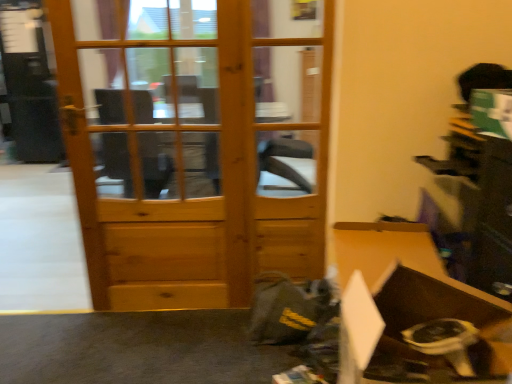
Where is `brown cardboard box at lower right`? The width and height of the screenshot is (512, 384). brown cardboard box at lower right is located at coordinates tap(422, 333).

What is the approximate height of brown cardboard box at lower right?

10.97 inches.

The image size is (512, 384). What do you see at coordinates (422, 333) in the screenshot? I see `brown cardboard box at lower right` at bounding box center [422, 333].

Identify the location of natural wood door at left. (195, 144).

What do you see at coordinates (195, 144) in the screenshot? I see `natural wood door at left` at bounding box center [195, 144].

Measure the distance between point (189, 43) and camera.

Point (189, 43) is 5.60 feet away from camera.

At what (x,y) coordinates should I click in order to perform the action: click on brown cardboard box at lower right. Please return your answer as a coordinate pair (x, y). The image size is (512, 384). Looking at the image, I should click on (422, 333).

Between natural wood door at left and brown cardboard box at lower right, which one appears on the left side from the viewer's perspective?

natural wood door at left.

Is natural wood door at left positioned in front of brown cardboard box at lower right?

No, it is not.

Is point (98, 181) closer or farther from the camera than point (395, 342)?

Point (98, 181) is farther from the camera than point (395, 342).

From the image's perspective, is natural wood door at left beneath brown cardboard box at lower right?

No.

From a real-world perspective, which object rests below the other?

In real-world perspective, brown cardboard box at lower right is lower.

Based on the photo, which of these two, natural wood door at left or brown cardboard box at lower right, is thinner?

With smaller width is natural wood door at left.

Consider the image. Considering the sizes of objects natural wood door at left and brown cardboard box at lower right in the image provided, who is taller, natural wood door at left or brown cardboard box at lower right?

With more height is natural wood door at left.

Which of these two, natural wood door at left or brown cardboard box at lower right, is bigger?

natural wood door at left is bigger.

Does natural wood door at left contain brown cardboard box at lower right?

Actually, brown cardboard box at lower right is outside natural wood door at left.

Is natural wood door at left placed right next to brown cardboard box at lower right?

natural wood door at left is not next to brown cardboard box at lower right, and they're not touching.

Looking at this image, is natural wood door at left facing towards brown cardboard box at lower right?

No, natural wood door at left is not facing towards brown cardboard box at lower right.

How different are the orientations of natural wood door at left and brown cardboard box at lower right in degrees?

102 degrees.

Locate an element on the screen. The height and width of the screenshot is (384, 512). cardboard box to the right of natural wood door at left is located at coordinates (422, 333).

Based on their positions, is brown cardboard box at lower right located to the left or right of natural wood door at left?

brown cardboard box at lower right is positioned on natural wood door at left's right side.

Between brown cardboard box at lower right and natural wood door at left, which one is positioned behind?

natural wood door at left is more distant.

Considering the positions of point (431, 374) and point (207, 134), is point (431, 374) closer or farther from the camera than point (207, 134)?

Point (431, 374) appears to be closer to the viewer than point (207, 134).

From the image's perspective, which object appears higher, brown cardboard box at lower right or natural wood door at left?

natural wood door at left is shown above in the image.

From a real-world perspective, who is located higher, brown cardboard box at lower right or natural wood door at left?

natural wood door at left is physically above.

Looking at their sizes, would you say brown cardboard box at lower right is wider or thinner than natural wood door at left?

Considering their sizes, brown cardboard box at lower right looks broader than natural wood door at left.

Considering the relative sizes of brown cardboard box at lower right and natural wood door at left in the image provided, is brown cardboard box at lower right taller than natural wood door at left?

In fact, brown cardboard box at lower right may be shorter than natural wood door at left.

Is brown cardboard box at lower right smaller than natural wood door at left?

Yes, brown cardboard box at lower right is smaller than natural wood door at left.

Is natural wood door at left a part of brown cardboard box at lower right?

No, natural wood door at left is not a part of brown cardboard box at lower right.

Would you consider brown cardboard box at lower right to be distant from natural wood door at left?

That's right, there is a large distance between brown cardboard box at lower right and natural wood door at left.

Is brown cardboard box at lower right facing away from natural wood door at left?

brown cardboard box at lower right is not turned away from natural wood door at left.

Find the location of `cardboard box on the right side of natural wood door at left`. cardboard box on the right side of natural wood door at left is located at coordinates (422, 333).

At what (x,y) coordinates should I click in order to perform the action: click on cardboard box located underneath the natural wood door at left (from a real-world perspective). Please return your answer as a coordinate pair (x, y). Image resolution: width=512 pixels, height=384 pixels. Looking at the image, I should click on (422, 333).

Image resolution: width=512 pixels, height=384 pixels. In order to click on cardboard box on the right of natural wood door at left in this screenshot , I will do `click(422, 333)`.